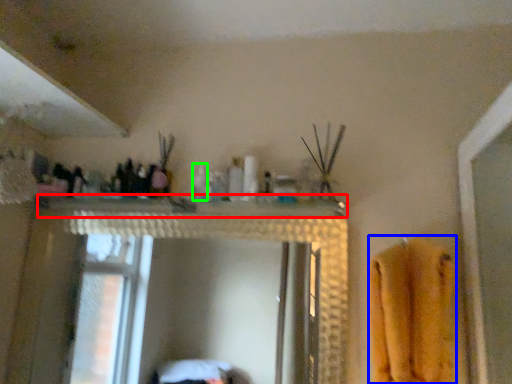
Question: Considering the real-world distances, which object is closest to counter top (highlighted by a red box)? bath towel (highlighted by a blue box) or toiletry (highlighted by a green box).

Choices:
 (A) bath towel
 (B) toiletry

Answer: (B)